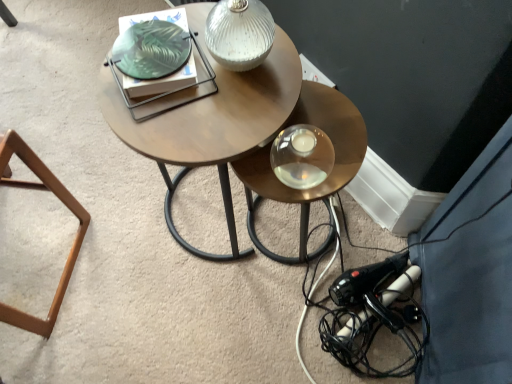
Locate an element on the screen. The height and width of the screenshot is (384, 512). blank area to the left of white textured glass table lamp at upper center is located at coordinates (160, 96).